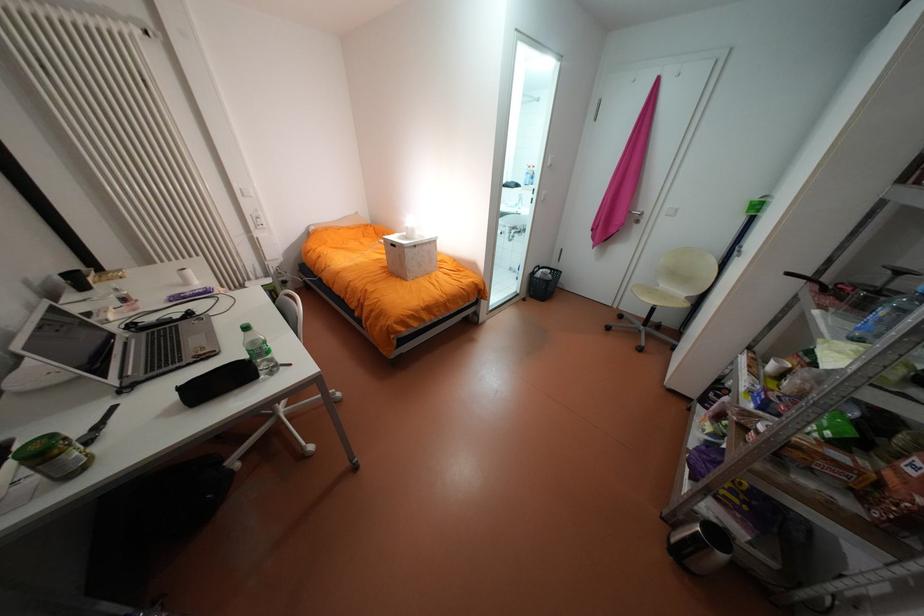
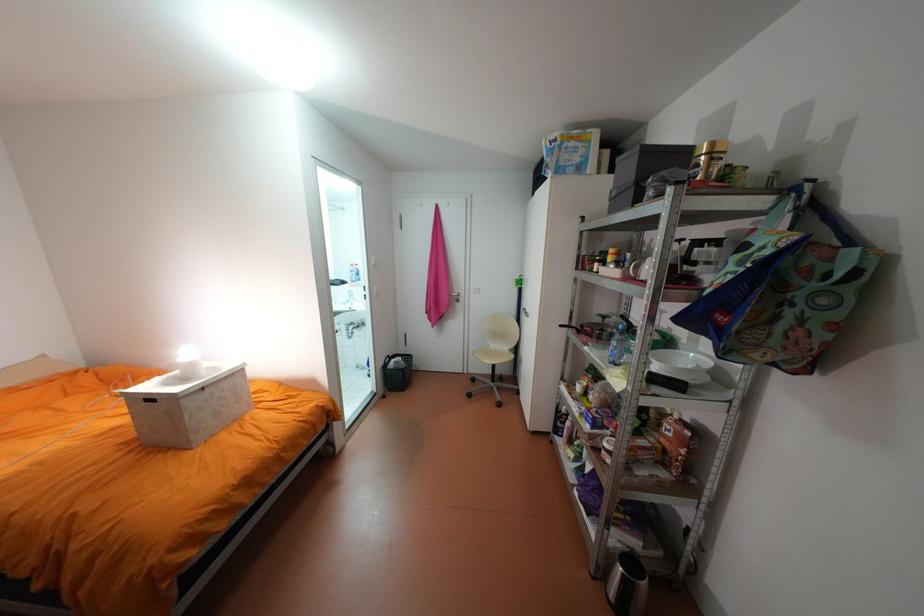
Where in the second image is the point corresponding to the point at 661,290 from the first image?

(497, 352)